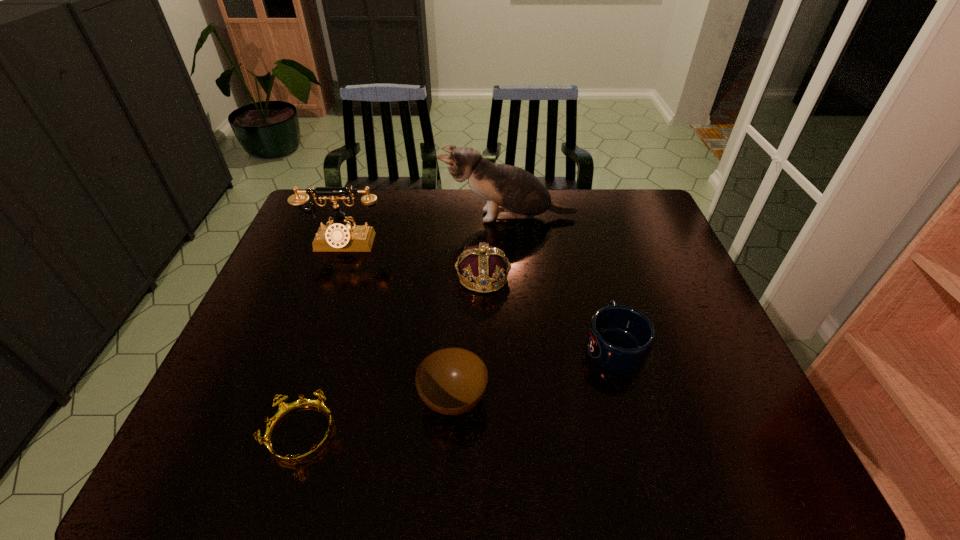
Select which object appears as the third closest to the taller crown. Please provide its 2D coordinates. Your answer should be formatted as a tuple, i.e. [(x, y)], where the tuple contains the x and y coordinates of a point satisfying the conditions above.

[(340, 236)]

The image size is (960, 540). In order to click on object identified as the third closest to the third tallest object in this screenshot , I will do `click(340, 236)`.

Locate an element on the screen. This screenshot has width=960, height=540. free space that satisfies the following two spatial constraints: 1. at the face of the tallest object; 2. on the front side of the farther crown is located at coordinates (515, 277).

Locate an element on the screen. The width and height of the screenshot is (960, 540). free point that satisfies the following two spatial constraints: 1. at the face of the tallest object; 2. on the front side of the farther crown is located at coordinates [515, 277].

Locate an element on the screen. free space that satisfies the following two spatial constraints: 1. at the face of the tallest object; 2. on the dial of the second tallest object is located at coordinates (512, 244).

Find the location of a particular element. This screenshot has height=540, width=960. free spot that satisfies the following two spatial constraints: 1. on the dial of the fifth nearest object; 2. on the right side of the nearer crown is located at coordinates (275, 434).

Locate an element on the screen. vacant space that satisfies the following two spatial constraints: 1. at the face of the tallest object; 2. on the front side of the fourth nearest object is located at coordinates (515, 277).

Locate an element on the screen. The image size is (960, 540). vacant area that satisfies the following two spatial constraints: 1. at the face of the tallest object; 2. on the dial of the fifth nearest object is located at coordinates (512, 244).

The height and width of the screenshot is (540, 960). Find the location of `vacant region that satisfies the following two spatial constraints: 1. on the dial of the telephone; 2. on the left side of the taller crown`. vacant region that satisfies the following two spatial constraints: 1. on the dial of the telephone; 2. on the left side of the taller crown is located at coordinates (331, 277).

Locate an element on the screen. Image resolution: width=960 pixels, height=540 pixels. vacant space that satisfies the following two spatial constraints: 1. at the face of the cat; 2. on the front side of the bowl is located at coordinates [x=524, y=399].